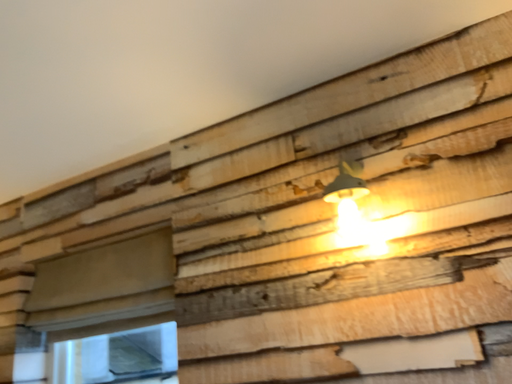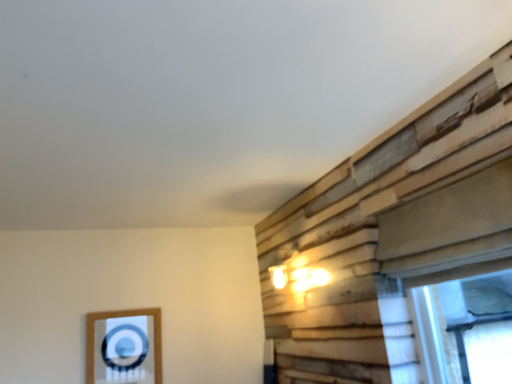
Question: Which way did the camera rotate in the video?

Choices:
 (A) rotated right
 (B) rotated left

Answer: (B)